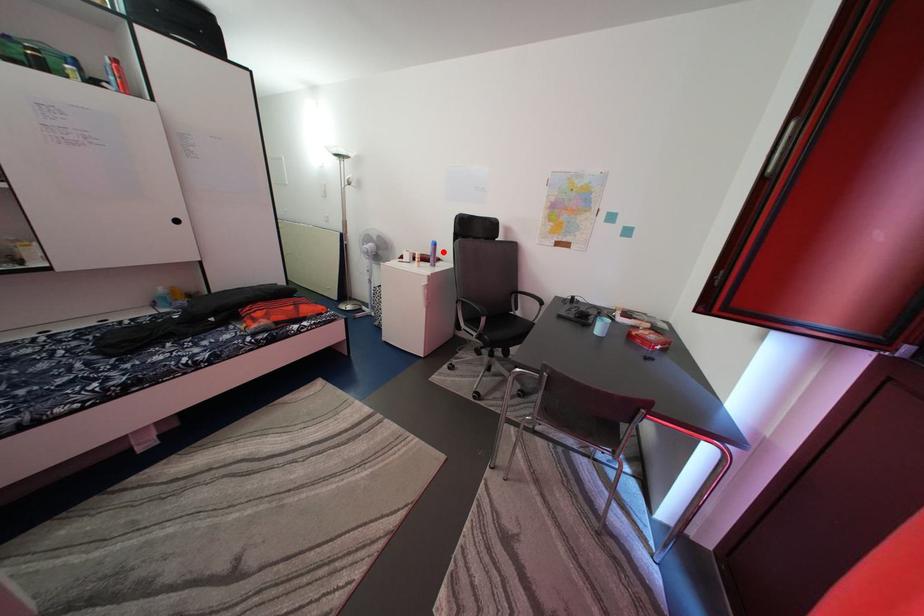
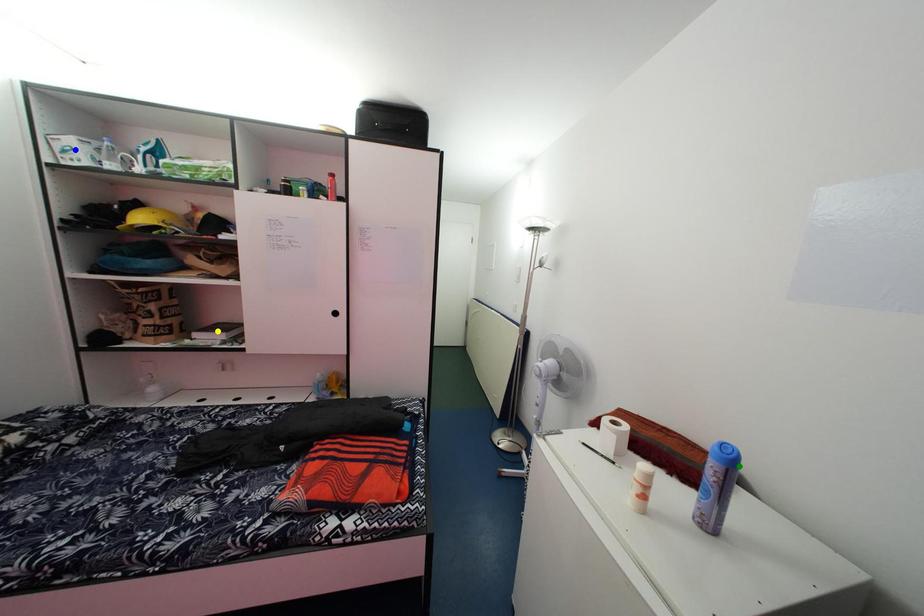
Question: I am providing you with two images of the same scene from different viewpoints. A red point is marked on the first image. You are given multiple points on the second image. In image 2, which mark is for the same physical point as the one in image 1?

Choices:
 (A) yellow point
 (B) blue point
 (C) green point

Answer: (C)